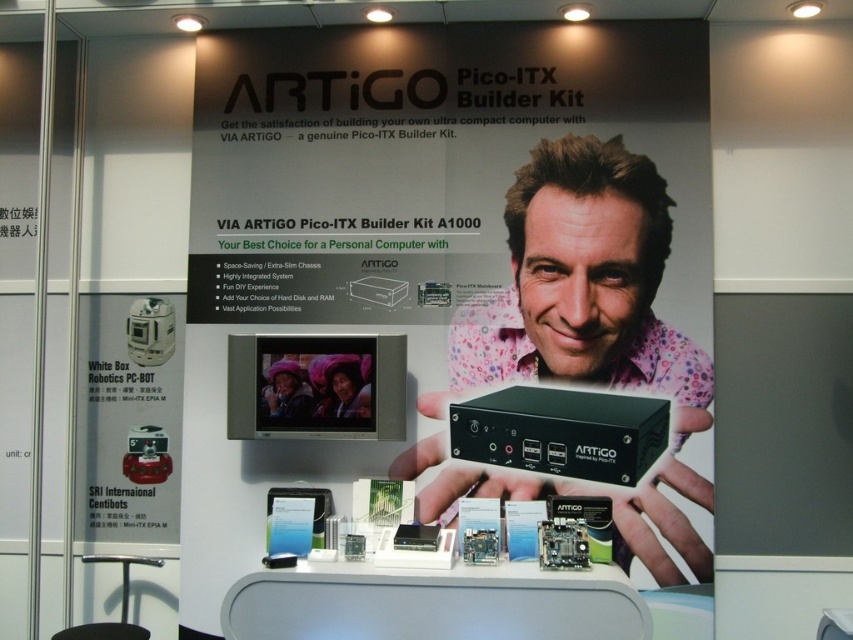
Does matte black computer at center have a greater height compared to white matte robot at left?

Indeed, matte black computer at center has a greater height compared to white matte robot at left.

Describe the element at coordinates (587, 282) in the screenshot. The image size is (853, 640). I see `matte black computer at center` at that location.

Where is `matte black computer at center`? This screenshot has width=853, height=640. matte black computer at center is located at coordinates (587, 282).

Can you confirm if matte black computer at center is bigger than black plastic artigo pico-itx builder kit at center?

Indeed, matte black computer at center has a larger size compared to black plastic artigo pico-itx builder kit at center.

Who is shorter, matte black computer at center or black plastic artigo pico-itx builder kit at center?

black plastic artigo pico-itx builder kit at center is shorter.

Between point (527, 164) and point (662, 440), which one is positioned in front?

Positioned in front is point (662, 440).

This screenshot has width=853, height=640. In order to click on matte black computer at center in this screenshot , I will do `click(587, 282)`.

Does white matte robot at left have a greater width compared to black plastic artigo pico-itx builder kit at center?

Incorrect, white matte robot at left's width does not surpass black plastic artigo pico-itx builder kit at center's.

Is white matte robot at left above black plastic artigo pico-itx builder kit at center?

Indeed, white matte robot at left is positioned over black plastic artigo pico-itx builder kit at center.

Which is in front, point (97, 468) or point (593, 417)?

Point (593, 417) is in front.

Where is `white matte robot at left`? Image resolution: width=853 pixels, height=640 pixels. white matte robot at left is located at coordinates (131, 419).